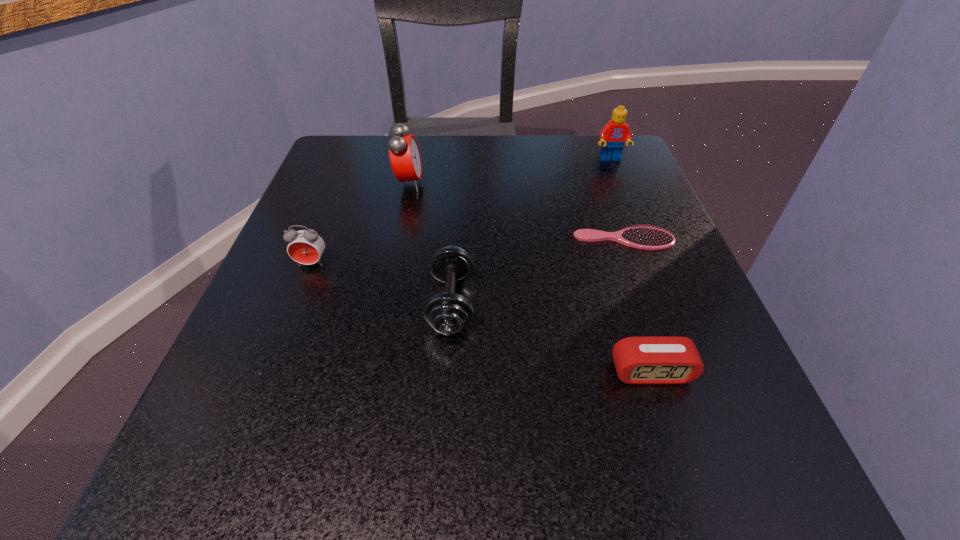
Where is `Lego`? Lego is located at coordinates (614, 134).

The height and width of the screenshot is (540, 960). Find the location of `the second farthest object`. the second farthest object is located at coordinates pos(405,158).

Locate an element on the screen. This screenshot has height=540, width=960. the farthest alarm clock is located at coordinates 405,158.

Identify the location of the second nearest alarm clock. This screenshot has height=540, width=960. (305, 247).

This screenshot has width=960, height=540. Identify the location of the leftmost object. (305, 247).

Where is `the third shortest object`? the third shortest object is located at coordinates (448, 313).

Identify the location of the fourth object from right to left. The height and width of the screenshot is (540, 960). (448, 313).

Image resolution: width=960 pixels, height=540 pixels. What are the coordinates of `the nearest object` in the screenshot? It's located at (655, 359).

Find the location of a particular element. the rightmost alarm clock is located at coordinates (655, 359).

Identify the location of the third farthest object. The height and width of the screenshot is (540, 960). (646, 238).